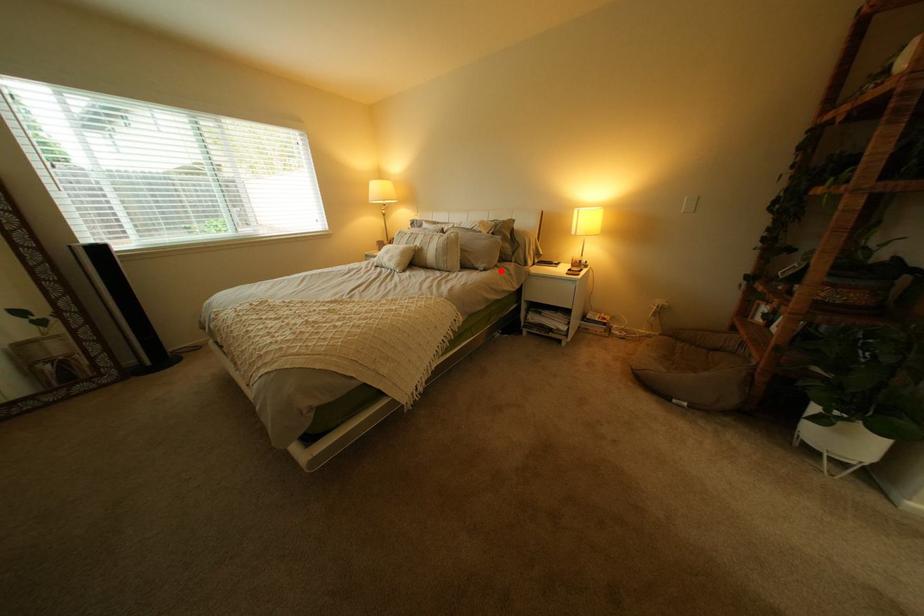
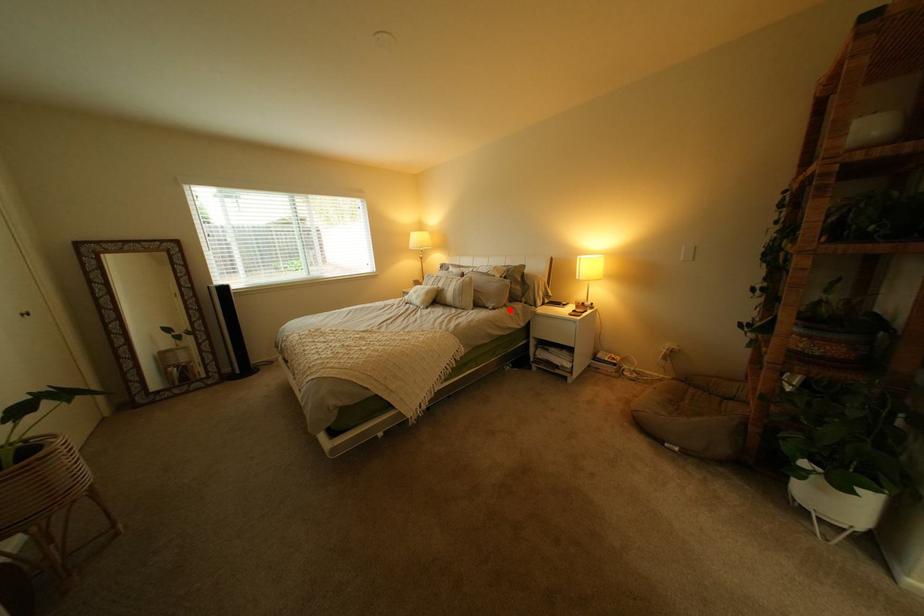
I am providing you with two images of the same scene from different viewpoints. A red point is marked on the first image and another point is marked on the second image. Are the points marked in image1 and image2 representing the same 3D position?

Yes